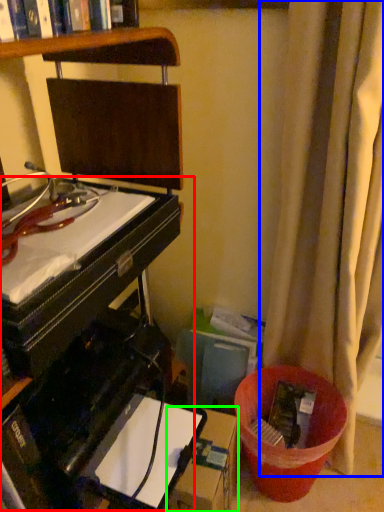
Question: Considering the real-world distances, which object is closest to computer desk (highlighted by a red box)? curtain (highlighted by a blue box) or cardboard box (highlighted by a green box).

Choices:
 (A) curtain
 (B) cardboard box

Answer: (B)